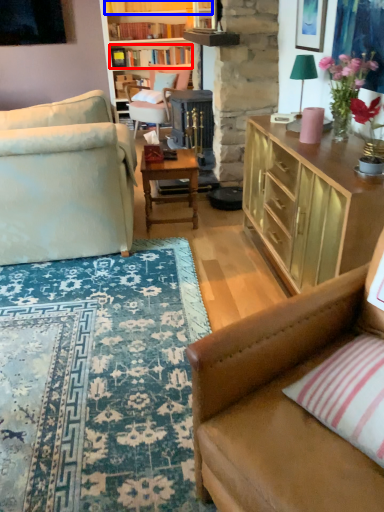
Question: Which of the following is the farthest to the observer, book (highlighted by a red box) or book (highlighted by a blue box)?

Choices:
 (A) book
 (B) book

Answer: (A)